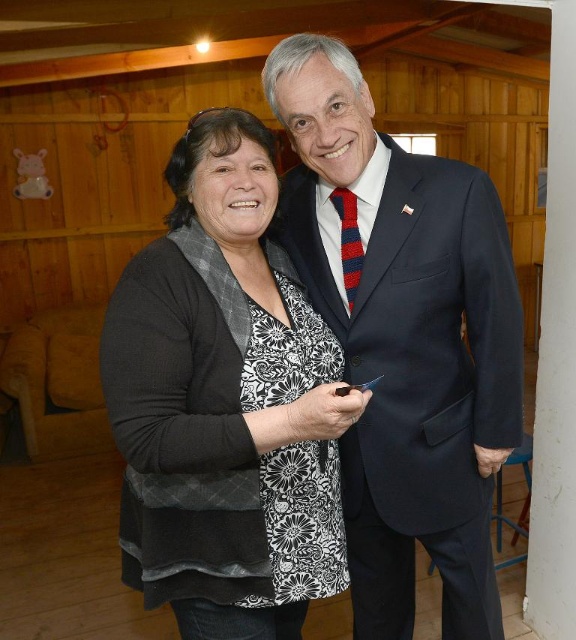
This screenshot has width=576, height=640. What do you see at coordinates (225, 403) in the screenshot? I see `black textured cardigan at center` at bounding box center [225, 403].

Does black textured cardigan at center have a greater height compared to red striped tie at center?

Correct, black textured cardigan at center is much taller as red striped tie at center.

Between point (301, 435) and point (351, 264), which one is positioned in front?

Point (301, 435)

Where is `black textured cardigan at center`? This screenshot has height=640, width=576. black textured cardigan at center is located at coordinates (225, 403).

Is black textured cardigan at center to the right of dark blue suit at center from the viewer's perspective?

Incorrect, black textured cardigan at center is not on the right side of dark blue suit at center.

Does black textured cardigan at center appear on the left side of dark blue suit at center?

Correct, you'll find black textured cardigan at center to the left of dark blue suit at center.

Is point (181, 586) farther from camera compared to point (467, 237)?

No, it is in front of (467, 237).

You are a GUI agent. You are given a task and a screenshot of the screen. Output one action in this format:
    pyautogui.click(x=<x>, y=<y>)
    Task: Click on the black textured cardigan at center
    
    Given the screenshot: What is the action you would take?
    pyautogui.click(x=225, y=403)

Looking at this image, does dark blue suit at center have a lesser width compared to red striped tie at center?

In fact, dark blue suit at center might be wider than red striped tie at center.

Identify the location of dark blue suit at center. This screenshot has width=576, height=640. (404, 340).